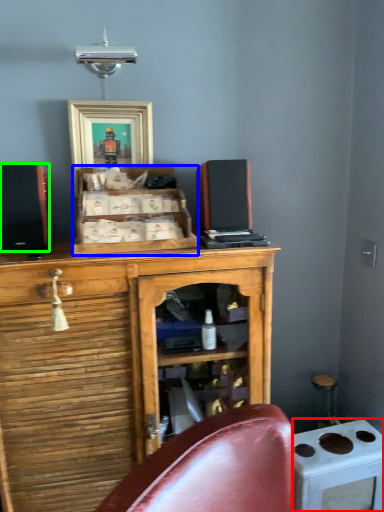
Question: Which object is positioned farthest from appliance (highlighted by a red box)? Select from cabinetry (highlighted by a blue box) and speaker (highlighted by a green box).

Choices:
 (A) cabinetry
 (B) speaker

Answer: (B)